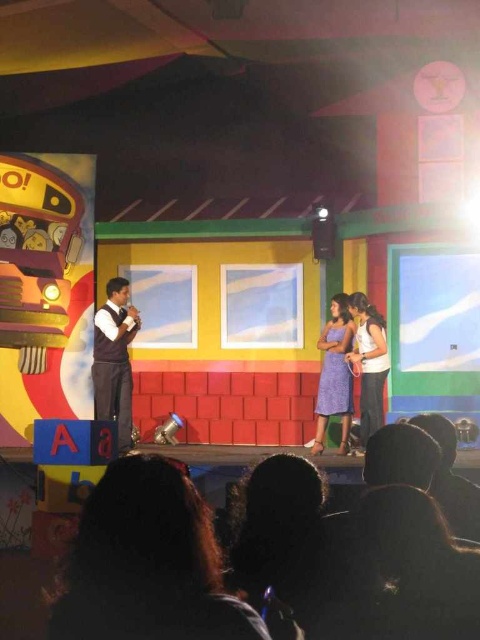
Does dark brown hair at lower center have a larger size compared to white matte shirt at right?

Incorrect, dark brown hair at lower center is not larger than white matte shirt at right.

Can you confirm if dark brown hair at lower center is taller than white matte shirt at right?

Incorrect, dark brown hair at lower center's height is not larger of white matte shirt at right's.

Identify the location of dark brown hair at lower center. Image resolution: width=480 pixels, height=640 pixels. (147, 563).

Does lavender fabric dress at center have a smaller size compared to white matte shirt at right?

Correct, lavender fabric dress at center occupies less space than white matte shirt at right.

Is lavender fabric dress at center in front of white matte shirt at right?

That is False.

At what (x,y) coordinates should I click in order to perform the action: click on lavender fabric dress at center. Please return your answer as a coordinate pair (x, y). Image resolution: width=480 pixels, height=640 pixels. Looking at the image, I should click on (335, 374).

Between point (101, 573) and point (99, 397), which one is positioned behind?

Positioned behind is point (99, 397).

Is dark brown hair at lower center above dark brown vest at center?

Yes, dark brown hair at lower center is above dark brown vest at center.

What do you see at coordinates (147, 563) in the screenshot?
I see `dark brown hair at lower center` at bounding box center [147, 563].

At what (x,y) coordinates should I click in order to perform the action: click on dark brown hair at lower center. Please return your answer as a coordinate pair (x, y). Looking at the image, I should click on (147, 563).